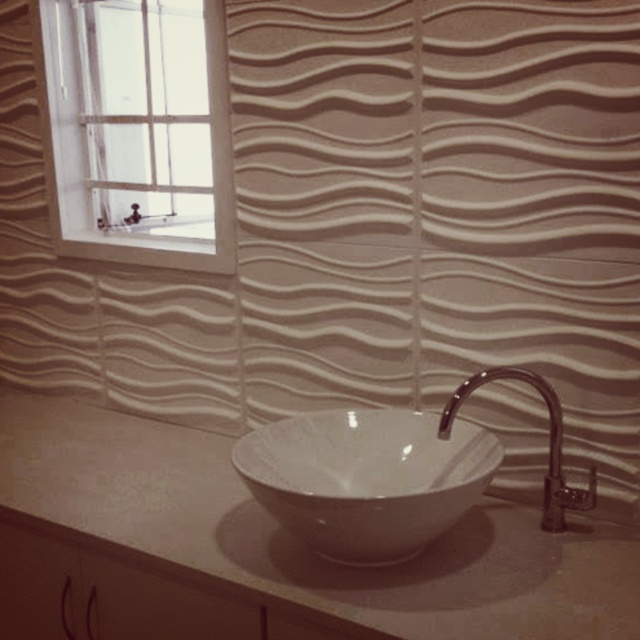
You are standing in the bathroom and want to open the white wooden window at upper left to let in fresh air. However, the polished chrome faucet at right is in your way. Can you reach the window without moving the faucet?

The white wooden window at upper left is further to the viewer than the polished chrome faucet at right, so the faucet is closer to you. Since the faucet is in front of the window, you cannot reach the window without moving the faucet.

You are a painter standing at the center of the bathroom. You want to paint the white wooden window at upper left but need to know if you can reach it from your current position. The painter can reach up to 1.5 meters. Can you reach the window?

The white wooden window at upper left is 1.55 meters away from the camera, which is slightly beyond the painter can reach up to 1.5 meters. Therefore, the painter cannot reach the window.

Based on the photo, you are standing in the bathroom and want to reach a point that is 3.66 feet away from you. Is the point at coordinates point (x=512, y=592) within your reach if your maximum reach is 3.5 feet?

The point (x=512, y=592) is 3.66 feet away from the viewer, which exceeds the maximum reach of 3.5 feet. Therefore, the point is out of reach.